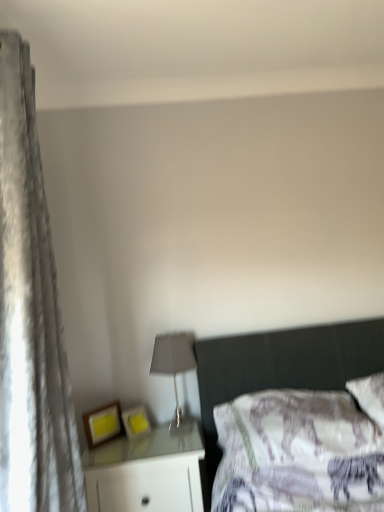
Identify the location of vacant space to the right of matte wooden picture frame at lower left, which ranks as the 2th picture frame in right-to-left order. This screenshot has height=512, width=384. (131, 436).